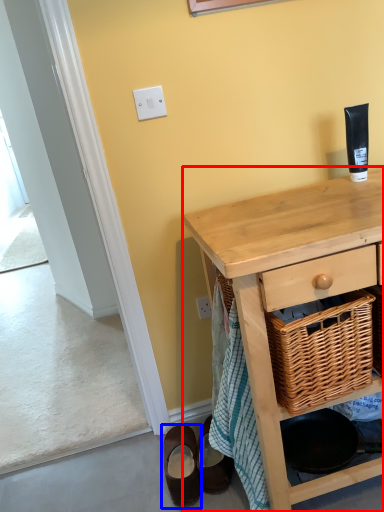
Question: Which object appears farthest to the camera in this image, desk (highlighted by a red box) or footwear (highlighted by a blue box)?

Choices:
 (A) desk
 (B) footwear

Answer: (B)